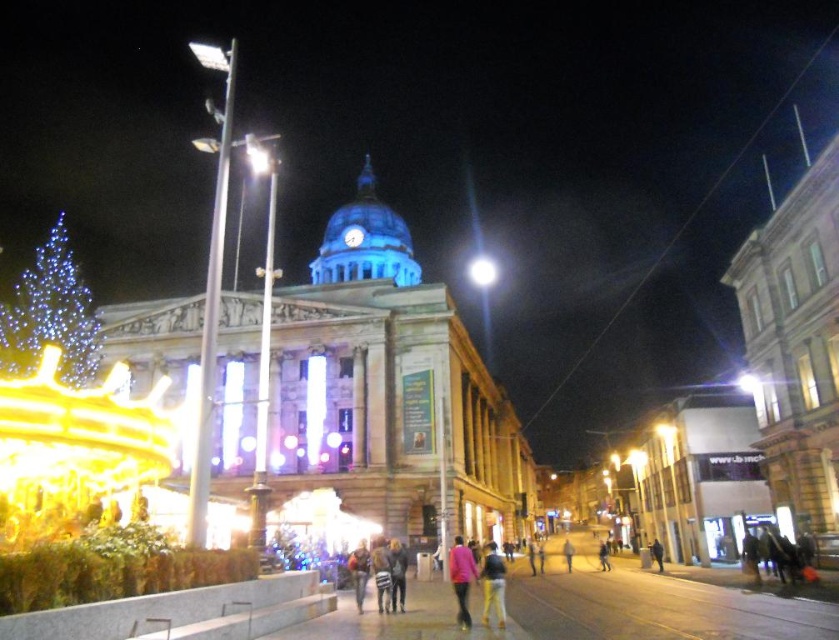
Question: Which point appears closest to the camera in this image?

Choices:
 (A) 496,273
 (B) 358,604

Answer: (B)

Question: Is blue led lights at left to the left of bright white light at center from the viewer's perspective?

Choices:
 (A) yes
 (B) no

Answer: (A)

Question: Is light brown pants at center wider than denim pants at center?

Choices:
 (A) no
 (B) yes

Answer: (A)

Question: Can you confirm if pink matte jacket at center is positioned to the right of denim pants at center?

Choices:
 (A) no
 (B) yes

Answer: (B)

Question: Which point appears farthest from the camera in this image?

Choices:
 (A) (363, 548)
 (B) (486, 588)
 (C) (468, 557)

Answer: (A)

Question: Which point is farther to the camera?

Choices:
 (A) pink matte jacket at center
 (B) blue led lights at left

Answer: (B)